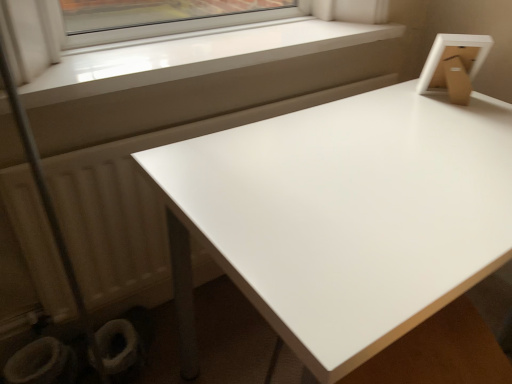
Describe the element at coordinates (204, 54) in the screenshot. This screenshot has width=512, height=384. I see `white smooth window sill at upper left` at that location.

What is the approximate width of white matte radiator at lower left?

white matte radiator at lower left is 1.28 meters in width.

Image resolution: width=512 pixels, height=384 pixels. What do you see at coordinates (42, 363) in the screenshot? I see `white glossy toilet bowl at lower left, the 1th toilet bowl viewed from the left` at bounding box center [42, 363].

The width and height of the screenshot is (512, 384). I want to click on white fabric toilet bowl at lower left, the 1th toilet bowl positioned from the right, so click(111, 343).

In the image, there is a white smooth window sill at upper left. Identify the location of table below it (from a real-world perspective). (343, 217).

From the image's perspective, does white glossy table at upper right appear lower than white smooth window sill at upper left?

Yes.

Considering the positions of objects white glossy table at upper right and white smooth window sill at upper left in the image provided, who is in front, white glossy table at upper right or white smooth window sill at upper left?

Positioned in front is white glossy table at upper right.

Which object is thinner, white glossy toilet bowl at lower left, the 1th toilet bowl viewed from the left, or white smooth window sill at upper left?

Answer: white glossy toilet bowl at lower left, the 1th toilet bowl viewed from the left, is thinner.

Visually, is white glossy toilet bowl at lower left, which appears as the 2th toilet bowl when viewed from the right, positioned to the left or to the right of white smooth window sill at upper left?

Clearly, white glossy toilet bowl at lower left, which appears as the 2th toilet bowl when viewed from the right, is on the left of white smooth window sill at upper left in the image.

Is white glossy toilet bowl at lower left, which appears as the 2th toilet bowl when viewed from the right, facing towards white smooth window sill at upper left?

No, white glossy toilet bowl at lower left, which appears as the 2th toilet bowl when viewed from the right, is not facing towards white smooth window sill at upper left.

Is white glossy toilet bowl at lower left, the 1th toilet bowl viewed from the left, taller than white smooth window sill at upper left?

Yes, white glossy toilet bowl at lower left, the 1th toilet bowl viewed from the left, is taller than white smooth window sill at upper left.

Considering the sizes of white smooth window sill at upper left and white glossy table at upper right in the image, is white smooth window sill at upper left wider or thinner than white glossy table at upper right?

In the image, white smooth window sill at upper left appears to be more narrow than white glossy table at upper right.

From a real-world perspective, is white smooth window sill at upper left over white glossy table at upper right?

Yes.

Is white smooth window sill at upper left with white glossy table at upper right?

No, white smooth window sill at upper left is not making contact with white glossy table at upper right.

How different are the orientations of white smooth window sill at upper left and white glossy table at upper right in degrees?

white smooth window sill at upper left and white glossy table at upper right are facing 0.354 degrees away from each other.

From a real-world perspective, between white smooth window sill at upper left and white matte radiator at lower left, who is vertically higher?

From a 3D spatial view, white smooth window sill at upper left is above.

How much distance is there between white smooth window sill at upper left and white matte radiator at lower left?

white smooth window sill at upper left and white matte radiator at lower left are 11.78 inches apart from each other.

Is white smooth window sill at upper left further to camera compared to white matte radiator at lower left?

No, white smooth window sill at upper left is in front of white matte radiator at lower left.

Find the location of `radiator above the white glossy table at upper right (from the image's perspective)`. radiator above the white glossy table at upper right (from the image's perspective) is located at coordinates (139, 204).

Considering the points (39, 204) and (487, 230), which point is in front, point (39, 204) or point (487, 230)?

The point (487, 230) is more forward.

From a real-world perspective, is white matte radiator at lower left on white glossy table at upper right?

Indeed, from a real-world perspective, white matte radiator at lower left stands above white glossy table at upper right.

How different are the orientations of white smooth window sill at upper left and white fabric toilet bowl at lower left, the 1th toilet bowl positioned from the right, in degrees?

The angle between the facing direction of white smooth window sill at upper left and the facing direction of white fabric toilet bowl at lower left, the 1th toilet bowl positioned from the right, is 90.2 degrees.

Does white smooth window sill at upper left have a smaller size compared to white fabric toilet bowl at lower left, the 1th toilet bowl positioned from the right?

No.

Who is more distant, white smooth window sill at upper left or white fabric toilet bowl at lower left, the 1th toilet bowl positioned from the right?

white fabric toilet bowl at lower left, the 1th toilet bowl positioned from the right.

Is white smooth window sill at upper left positioned far away from white fabric toilet bowl at lower left, which appears as the 2th toilet bowl when viewed from the left?

white smooth window sill at upper left is near white fabric toilet bowl at lower left, which appears as the 2th toilet bowl when viewed from the left, not far away.

Can you confirm if white smooth window sill at upper left is bigger than white glossy toilet bowl at lower left, which appears as the 2th toilet bowl when viewed from the right?

Yes.

From a real-world perspective, is white smooth window sill at upper left positioned under white glossy toilet bowl at lower left, the 1th toilet bowl viewed from the left, based on gravity?

No, from a real-world perspective, white smooth window sill at upper left is not beneath white glossy toilet bowl at lower left, the 1th toilet bowl viewed from the left.

At what (x,y) coordinates should I click in order to perform the action: click on window in front of the white glossy toilet bowl at lower left, the 1th toilet bowl viewed from the left. Please return your answer as a coordinate pair (x, y). Looking at the image, I should click on (204, 54).

Is white smooth window sill at upper left taller or shorter than white glossy toilet bowl at lower left, which appears as the 2th toilet bowl when viewed from the right?

Clearly, white smooth window sill at upper left is shorter compared to white glossy toilet bowl at lower left, which appears as the 2th toilet bowl when viewed from the right.

Find the location of a particular element. This screenshot has width=512, height=384. window above the white glossy table at upper right (from a real-world perspective) is located at coordinates (204, 54).

Locate an element on the screen. window located in front of the white glossy toilet bowl at lower left, the 1th toilet bowl viewed from the left is located at coordinates (204, 54).

Estimate the real-world distances between objects in this image. Which object is further from white fabric toilet bowl at lower left, the 1th toilet bowl positioned from the right, white glossy toilet bowl at lower left, the 1th toilet bowl viewed from the left, or white glossy table at upper right?

Among the two, white glossy table at upper right is located further to white fabric toilet bowl at lower left, the 1th toilet bowl positioned from the right.

Which object lies further to the anchor point white fabric toilet bowl at lower left, which appears as the 2th toilet bowl when viewed from the left, white glossy toilet bowl at lower left, which appears as the 2th toilet bowl when viewed from the right, or white smooth window sill at upper left?

white smooth window sill at upper left is further to white fabric toilet bowl at lower left, which appears as the 2th toilet bowl when viewed from the left.

Consider the image. Considering their positions, is white matte radiator at lower left positioned further to white fabric toilet bowl at lower left, the 1th toilet bowl positioned from the right, than white glossy table at upper right?

white glossy table at upper right is positioned further to the anchor white fabric toilet bowl at lower left, the 1th toilet bowl positioned from the right.

Estimate the real-world distances between objects in this image. Which object is closer to white matte radiator at lower left, white smooth window sill at upper left or white fabric toilet bowl at lower left, which appears as the 2th toilet bowl when viewed from the left?

Based on the image, white smooth window sill at upper left appears to be nearer to white matte radiator at lower left.

Estimate the real-world distances between objects in this image. Which object is closer to white glossy table at upper right, white fabric toilet bowl at lower left, the 1th toilet bowl positioned from the right, or white matte radiator at lower left?

white matte radiator at lower left lies closer to white glossy table at upper right than the other object.

From the image, which object appears to be farther from white glossy table at upper right, white smooth window sill at upper left or white glossy toilet bowl at lower left, which appears as the 2th toilet bowl when viewed from the right?

Among the two, white glossy toilet bowl at lower left, which appears as the 2th toilet bowl when viewed from the right, is located further to white glossy table at upper right.

Based on the photo, estimate the real-world distances between objects in this image. Which object is closer to white matte radiator at lower left, white smooth window sill at upper left or white glossy toilet bowl at lower left, the 1th toilet bowl viewed from the left?

white smooth window sill at upper left lies closer to white matte radiator at lower left than the other object.

Considering their positions, is white matte radiator at lower left positioned closer to white glossy table at upper right than white smooth window sill at upper left?

white matte radiator at lower left is positioned closer to the anchor white glossy table at upper right.

This screenshot has width=512, height=384. Find the location of `radiator between white smooth window sill at upper left and white fabric toilet bowl at lower left, which appears as the 2th toilet bowl when viewed from the left, vertically`. radiator between white smooth window sill at upper left and white fabric toilet bowl at lower left, which appears as the 2th toilet bowl when viewed from the left, vertically is located at coordinates (139, 204).

Where is `radiator between white fabric toilet bowl at lower left, which appears as the 2th toilet bowl when viewed from the left, and white glossy table at upper right from left to right`? This screenshot has width=512, height=384. radiator between white fabric toilet bowl at lower left, which appears as the 2th toilet bowl when viewed from the left, and white glossy table at upper right from left to right is located at coordinates (139, 204).

At what (x,y) coordinates should I click in order to perform the action: click on radiator that lies between white smooth window sill at upper left and white glossy toilet bowl at lower left, the 1th toilet bowl viewed from the left, from top to bottom. Please return your answer as a coordinate pair (x, y). Image resolution: width=512 pixels, height=384 pixels. Looking at the image, I should click on (139, 204).

Identify the location of toilet bowl between white matte radiator at lower left and white glossy toilet bowl at lower left, which appears as the 2th toilet bowl when viewed from the right, in the up-down direction. This screenshot has height=384, width=512. (111, 343).